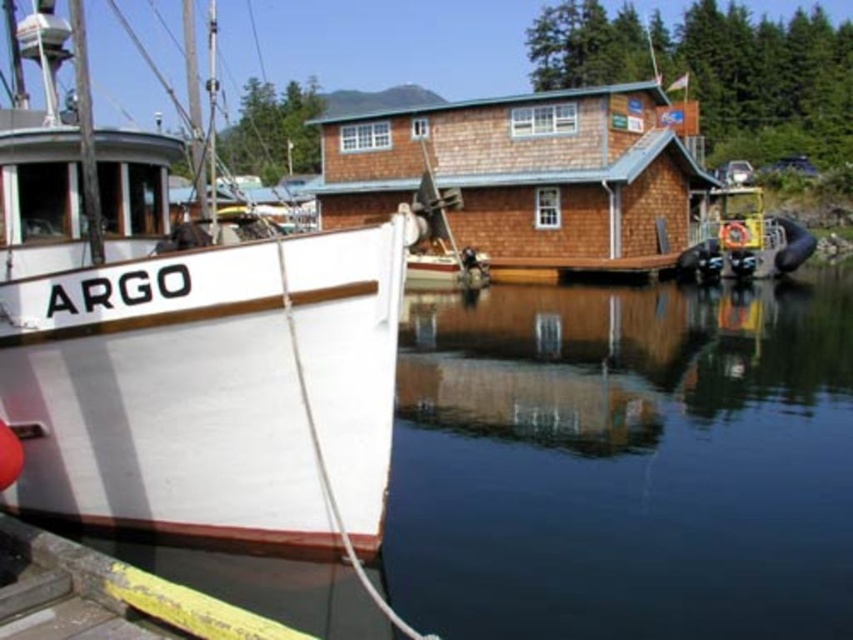
Question: Among these points, which one is nearest to the camera?

Choices:
 (A) (764, 486)
 (B) (670, 182)

Answer: (A)

Question: Does clear water at lower left come behind brown shingle cabin at center?

Choices:
 (A) yes
 (B) no

Answer: (B)

Question: Which of the following is the farthest from the observer?

Choices:
 (A) clear water at lower left
 (B) white matte boat at left
 (C) brown shingle cabin at center

Answer: (C)

Question: Which object appears closest to the camera in this image?

Choices:
 (A) brown shingle cabin at center
 (B) white matte boat at left

Answer: (B)

Question: Observing the image, what is the correct spatial positioning of clear water at lower left in reference to white matte boat at left?

Choices:
 (A) left
 (B) right

Answer: (B)

Question: Observing the image, what is the correct spatial positioning of clear water at lower left in reference to white matte boat at left?

Choices:
 (A) right
 (B) left

Answer: (A)